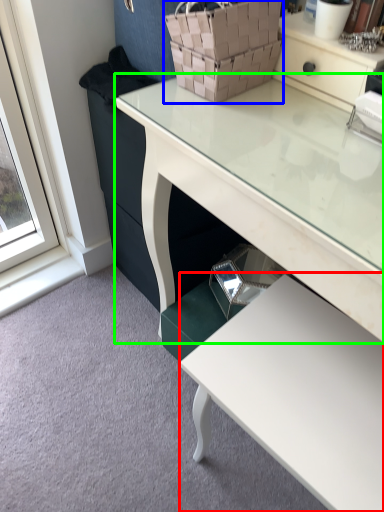
Question: Considering the real-world distances, which object is farthest from table (highlighted by a red box)? basket (highlighted by a blue box) or desk (highlighted by a green box)?

Choices:
 (A) basket
 (B) desk

Answer: (A)